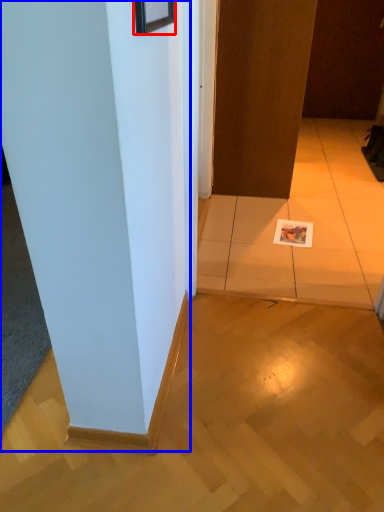
Question: Which object appears closest to the camera in this image, picture frame (highlighted by a red box) or pillar (highlighted by a blue box)?

Choices:
 (A) picture frame
 (B) pillar

Answer: (A)